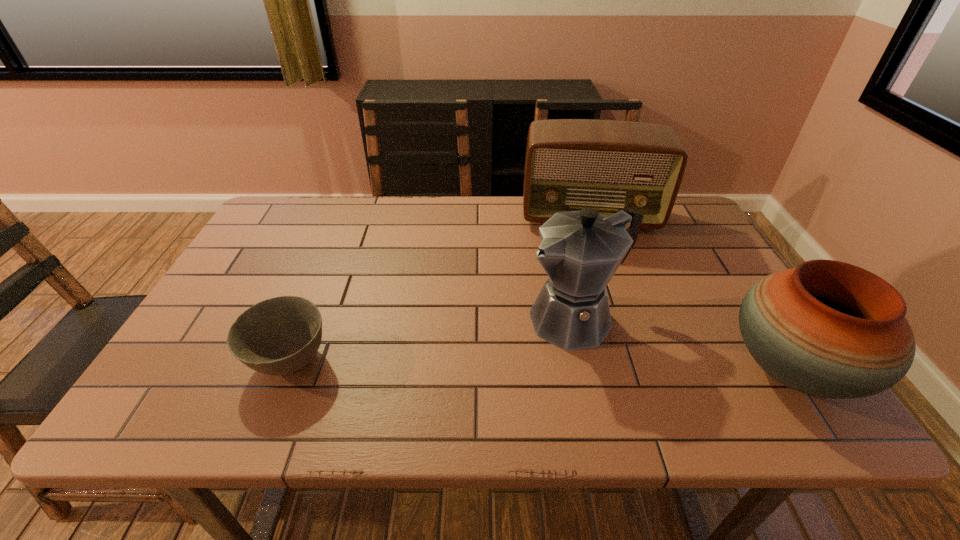
The image size is (960, 540). In order to click on object at the far right corner in this screenshot , I will do `click(608, 165)`.

Where is `object at the near right corner`? This screenshot has height=540, width=960. object at the near right corner is located at coordinates (826, 328).

At what (x,y) coordinates should I click in order to perform the action: click on vacant space at the far edge. Please return your answer as a coordinate pair (x, y). This screenshot has width=960, height=540. Looking at the image, I should click on (377, 224).

Find the location of a particular element. This screenshot has height=540, width=960. vacant space at the near edge of the desktop is located at coordinates (610, 370).

Where is `free space at the left edge`? This screenshot has width=960, height=540. free space at the left edge is located at coordinates (257, 286).

Where is `free space at the right edge`? This screenshot has height=540, width=960. free space at the right edge is located at coordinates click(674, 257).

Where is `vacant position at the far left corner of the desktop`? The width and height of the screenshot is (960, 540). vacant position at the far left corner of the desktop is located at coordinates (301, 204).

Identify the location of vacant area at the far right corner of the desktop. This screenshot has height=540, width=960. (688, 221).

At what (x,y) coordinates should I click in order to perform the action: click on free space that is in between the coffeepot and the third tallest object. Please return your answer as a coordinate pair (x, y). This screenshot has height=540, width=960. Looking at the image, I should click on (684, 345).

At what (x,y) coordinates should I click in order to perform the action: click on free spot between the radio receiver and the shortest object. Please return your answer as a coordinate pair (x, y). The width and height of the screenshot is (960, 540). Looking at the image, I should click on (440, 289).